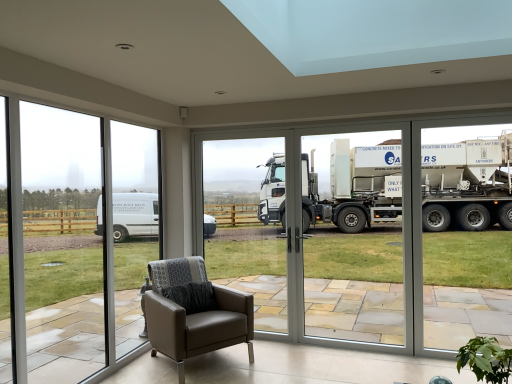
Question: Is white glossy truck at center in front of or behind transparent glass door at center in the image?

Choices:
 (A) front
 (B) behind

Answer: (A)

Question: Is white glossy truck at center to the left or to the right of transparent glass door at center in the image?

Choices:
 (A) right
 (B) left

Answer: (A)

Question: Which object is the farthest from the brown leather armchair at lower center?

Choices:
 (A) white glossy truck at center
 (B) transparent glass window at left
 (C) green leafy plant at lower right
 (D) transparent glass door at center

Answer: (A)

Question: Estimate the real-world distances between objects in this image. Which object is closer to the green leafy plant at lower right?

Choices:
 (A) transparent glass door at center
 (B) white glossy truck at center
 (C) brown leather armchair at lower center
 (D) transparent glass window at left

Answer: (C)